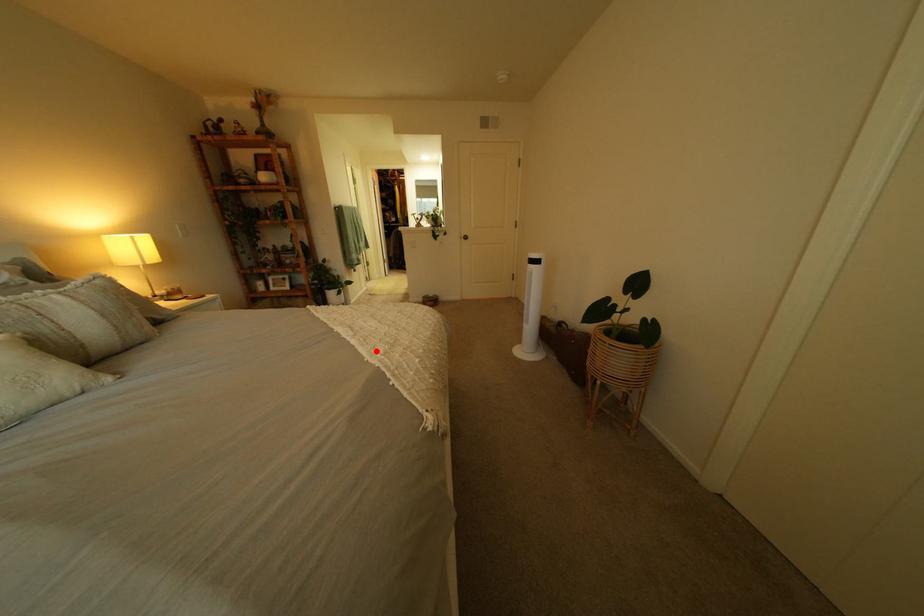
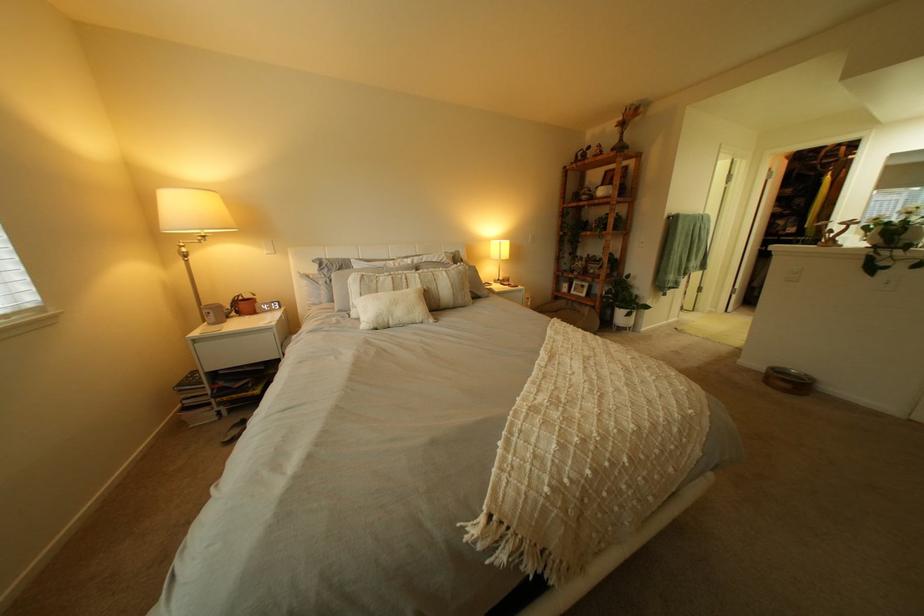
Where in the second image is the point corresponding to the highlighted location from the first image?

(541, 387)